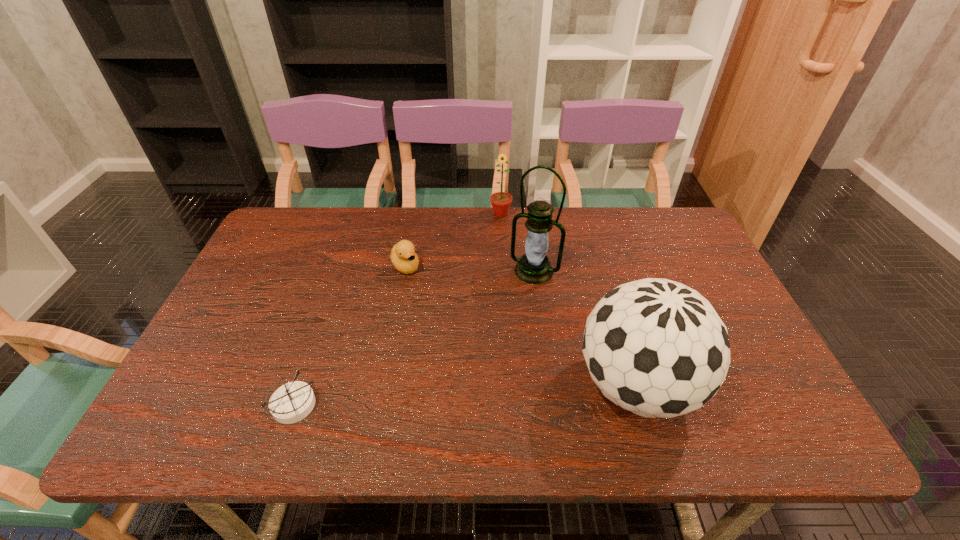
This screenshot has width=960, height=540. Identify the location of compass that is at the near edge. pyautogui.click(x=292, y=402).

You are a GUI agent. You are given a task and a screenshot of the screen. Output one action in this format:
    pyautogui.click(x=<x>, y=<y>)
    Task: Click on the soccer ball that is at the near edge
    The width and height of the screenshot is (960, 540).
    Given the screenshot: What is the action you would take?
    pyautogui.click(x=657, y=348)

You are a GUI agent. You are given a task and a screenshot of the screen. Output one action in this format:
    pyautogui.click(x=<x>, y=<y>)
    Task: Click on the free space at the far edge
    The image size is (960, 540).
    Given the screenshot: What is the action you would take?
    pyautogui.click(x=511, y=221)

In the image, there is a desktop. Where is `blank space at the near edge`? This screenshot has width=960, height=540. blank space at the near edge is located at coordinates (391, 386).

You are a GUI agent. You are given a task and a screenshot of the screen. Output one action in this format:
    pyautogui.click(x=<x>, y=<y>)
    Task: Click on the free space at the left edge
    This screenshot has width=960, height=540.
    Given the screenshot: What is the action you would take?
    pyautogui.click(x=231, y=341)

The width and height of the screenshot is (960, 540). Identify the location of vacant space at the right edge. click(704, 297).

The height and width of the screenshot is (540, 960). In the image, there is a desktop. What are the coordinates of `vacant space at the far left corner` in the screenshot? It's located at (317, 240).

Locate an element on the screen. The image size is (960, 540). vacant space at the far right corner is located at coordinates (664, 232).

Identify the location of free space at the near right corner. (728, 400).

At what (x,y) coordinates should I click in order to perform the action: click on free space between the sunflower and the soccer ball. Please return your answer as a coordinate pair (x, y). Image resolution: width=960 pixels, height=540 pixels. Looking at the image, I should click on (568, 300).